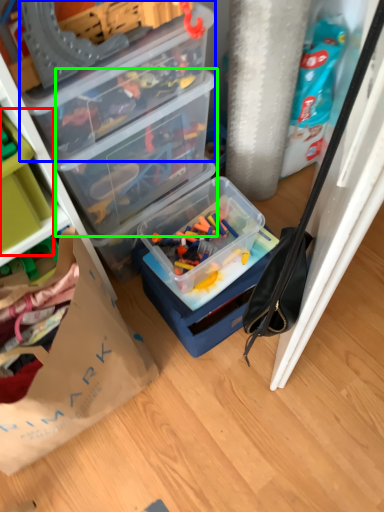
Question: Which is farther away from storage box (highlighted by a red box)? box (highlighted by a blue box) or box (highlighted by a green box)?

Choices:
 (A) box
 (B) box

Answer: (B)